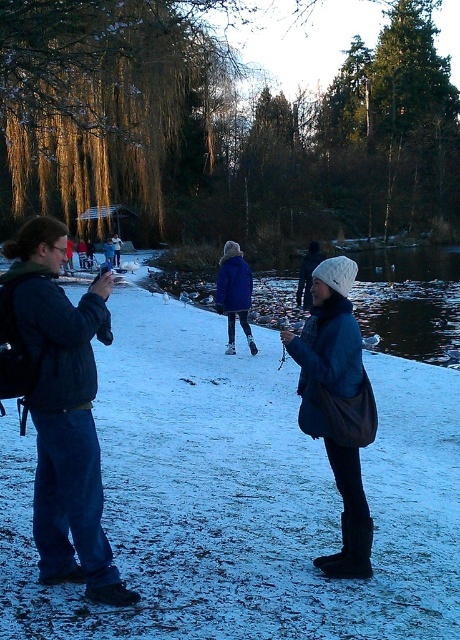
You are a photographer trying to capture the glossy blue lake at center and the blue woolen coat at center in a single frame. Based on their heights, which object will appear larger in the photo?

The glossy blue lake at center will appear larger in the photo because it has a greater height compared to the blue woolen coat at center.